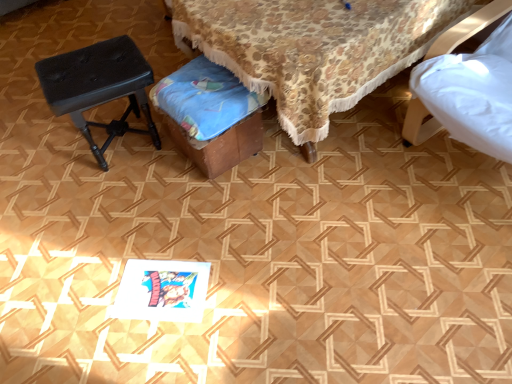
The width and height of the screenshot is (512, 384). What are the coordinates of `vacant area located to the right-hand side of wooden music stool at center` in the screenshot? It's located at (296, 168).